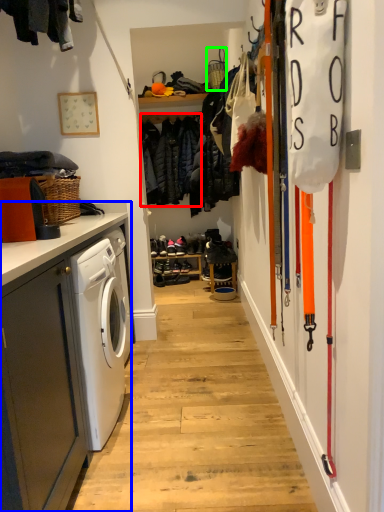
Question: Estimate the real-world distances between objects in this image. Which object is farther from clothing (highlighted by a red box), cabinetry (highlighted by a blue box) or basket (highlighted by a green box)?

Choices:
 (A) cabinetry
 (B) basket

Answer: (A)